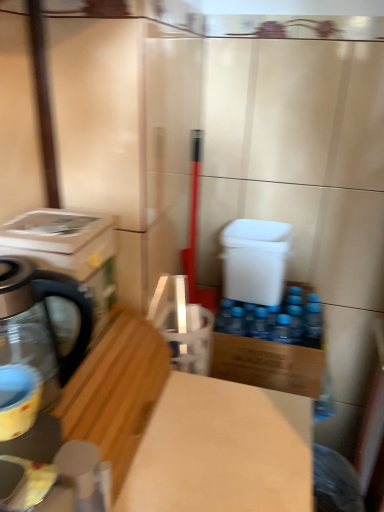
The width and height of the screenshot is (384, 512). Find the location of `empty space that is ontop of light brown wood at center`. empty space that is ontop of light brown wood at center is located at coordinates (204, 439).